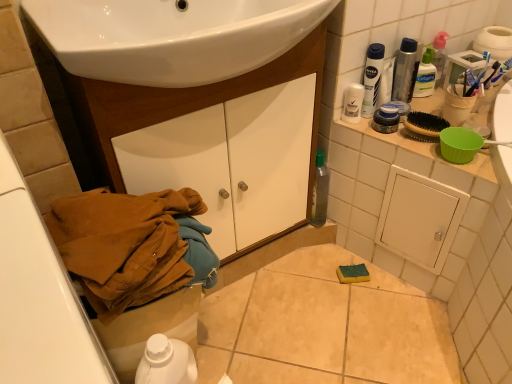
Question: Is blue plastic toothbrush at upper right oriented towards white plastic bottle at upper right, placed as the second mouthwash when sorted from bottom to top?

Choices:
 (A) yes
 (B) no

Answer: (B)

Question: Does blue plastic toothbrush at upper right appear on the right side of white plastic bottle at upper right, placed as the second mouthwash when sorted from bottom to top?

Choices:
 (A) no
 (B) yes

Answer: (B)

Question: Considering the relative sizes of blue plastic toothbrush at upper right and white plastic bottle at upper right, placed as the second mouthwash when sorted from bottom to top, in the image provided, is blue plastic toothbrush at upper right smaller than white plastic bottle at upper right, placed as the second mouthwash when sorted from bottom to top,?

Choices:
 (A) no
 (B) yes

Answer: (B)

Question: From a real-world perspective, is blue plastic toothbrush at upper right located higher than white plastic bottle at upper right, which ranks as the 1th mouthwash in top-to-bottom order?

Choices:
 (A) no
 (B) yes

Answer: (A)

Question: Considering the relative sizes of blue plastic toothbrush at upper right and white plastic bottle at upper right, placed as the second mouthwash when sorted from bottom to top, in the image provided, is blue plastic toothbrush at upper right thinner than white plastic bottle at upper right, placed as the second mouthwash when sorted from bottom to top,?

Choices:
 (A) no
 (B) yes

Answer: (B)

Question: Based on their sizes in the image, would you say white matte deodorant stick at upper right, the 1th toiletry ordered from the bottom, is bigger or smaller than blue glossy jar at upper right, marked as the 1th mouthwash in a bottom-to-top arrangement?

Choices:
 (A) big
 (B) small

Answer: (B)

Question: From the image's perspective, is white matte deodorant stick at upper right, the 1th toiletry viewed from the left, located above or below blue glossy jar at upper right, marked as the 1th mouthwash in a bottom-to-top arrangement?

Choices:
 (A) above
 (B) below

Answer: (A)

Question: Considering the positions of point (353, 107) and point (391, 117), is point (353, 107) closer or farther from the camera than point (391, 117)?

Choices:
 (A) closer
 (B) farther

Answer: (B)

Question: From their relative heights in the image, would you say white matte deodorant stick at upper right, which ranks as the 2th toiletry in right-to-left order, is taller or shorter than blue glossy jar at upper right, which is the second mouthwash from top to bottom?

Choices:
 (A) short
 (B) tall

Answer: (B)

Question: Is white plastic toilet bowl at lower left taller or shorter than blue plastic toothbrush at upper right?

Choices:
 (A) short
 (B) tall

Answer: (B)

Question: Considering the positions of white plastic toilet bowl at lower left and blue plastic toothbrush at upper right in the image, is white plastic toilet bowl at lower left bigger or smaller than blue plastic toothbrush at upper right?

Choices:
 (A) small
 (B) big

Answer: (B)

Question: In the image, is white plastic toilet bowl at lower left on the left side or the right side of blue plastic toothbrush at upper right?

Choices:
 (A) right
 (B) left

Answer: (B)

Question: Is white plastic toilet bowl at lower left inside the boundaries of blue plastic toothbrush at upper right, or outside?

Choices:
 (A) inside
 (B) outside

Answer: (B)

Question: From a real-world perspective, is white plastic bottle at upper right, placed as the second mouthwash when sorted from bottom to top, physically located above or below metallic silver spray can at upper right?

Choices:
 (A) below
 (B) above

Answer: (B)

Question: Do you think white plastic bottle at upper right, which ranks as the 1th mouthwash in top-to-bottom order, is within metallic silver spray can at upper right, or outside of it?

Choices:
 (A) inside
 (B) outside

Answer: (B)